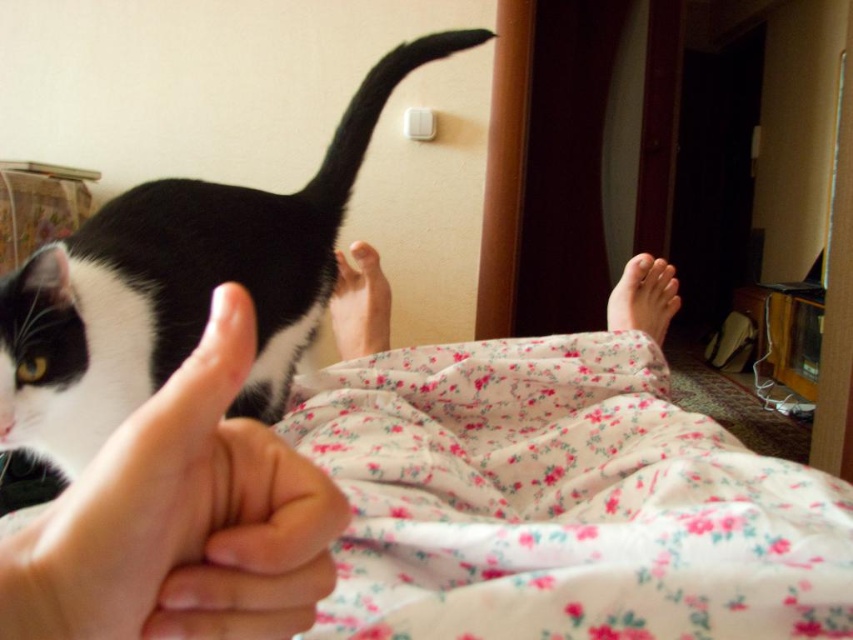
Question: Does floral cotton blanket at lower center appear on the right side of pink soft skin at center?

Choices:
 (A) no
 (B) yes

Answer: (B)

Question: Which object is the closest to the white matte hand at lower left?

Choices:
 (A) black and white fur cat at left
 (B) pink floral fabric at lower right
 (C) pink soft skin at center
 (D) floral cotton blanket at lower center

Answer: (D)

Question: Which point is closer to the camera?

Choices:
 (A) (251, 193)
 (B) (341, 352)

Answer: (A)

Question: Does floral cotton blanket at lower center have a greater width compared to black and white fur cat at left?

Choices:
 (A) yes
 (B) no

Answer: (A)

Question: Does floral cotton blanket at lower center appear on the left side of pink floral fabric at lower right?

Choices:
 (A) no
 (B) yes

Answer: (B)

Question: Which point is closer to the camera taking this photo?

Choices:
 (A) (3, 380)
 (B) (190, 378)

Answer: (B)